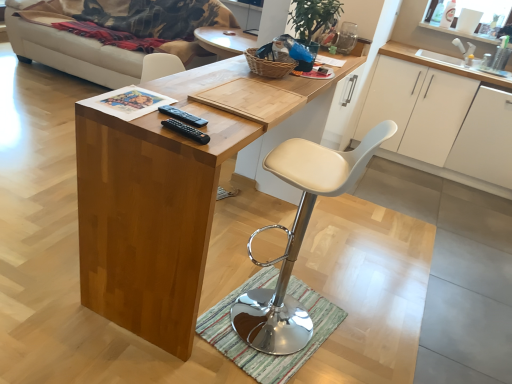
This screenshot has width=512, height=384. Find the location of `vacant space behind black plastic remote at center`. vacant space behind black plastic remote at center is located at coordinates (178, 96).